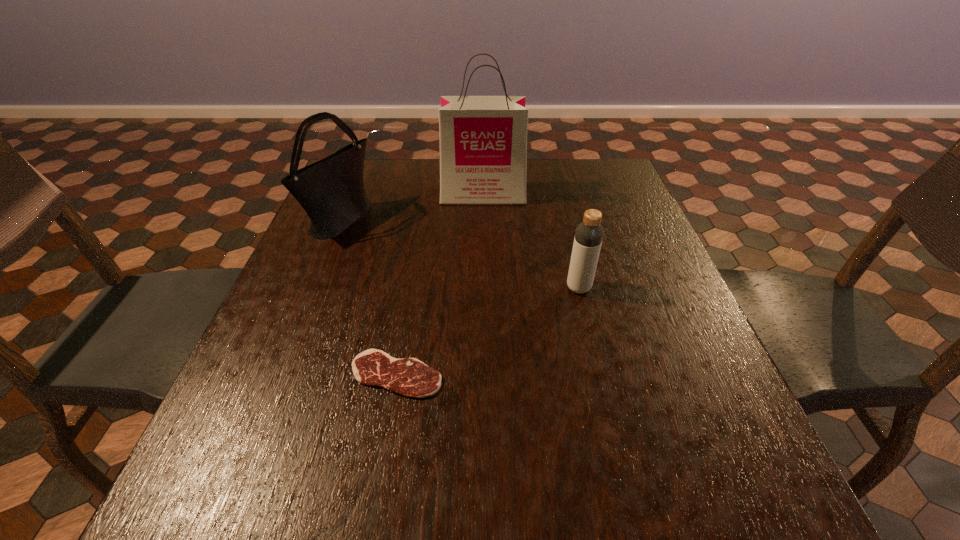
This screenshot has width=960, height=540. I want to click on free point located on the back of the nearest object, so click(x=419, y=245).

You are a GUI agent. You are given a task and a screenshot of the screen. Output one action in this format:
    pyautogui.click(x=<x>, y=<y>)
    Task: Click on the shopping bag that is at the far edge
    
    Given the screenshot: What is the action you would take?
    pos(483,139)

Where is `shoulder bag at the far edge`? shoulder bag at the far edge is located at coordinates (331, 191).

You are a GUI agent. You are given a task and a screenshot of the screen. Output one action in this format:
    pyautogui.click(x=<x>, y=<y>)
    Task: Click on the object that is at the left edge
    This screenshot has height=540, width=960.
    Given the screenshot: What is the action you would take?
    pyautogui.click(x=331, y=191)

This screenshot has width=960, height=540. In order to click on object that is at the far left corner in this screenshot , I will do `click(331, 191)`.

Where is `free location at the far edge`? This screenshot has width=960, height=540. free location at the far edge is located at coordinates (574, 194).

In the image, there is a desktop. At what (x,y) coordinates should I click in order to perform the action: click on free space at the near edge. Please return your answer as a coordinate pair (x, y). The height and width of the screenshot is (540, 960). Looking at the image, I should click on (657, 496).

This screenshot has width=960, height=540. Find the location of `free location at the left edge`. free location at the left edge is located at coordinates (330, 292).

I want to click on vacant area at the right edge, so click(x=610, y=248).

I want to click on free space at the far left corner, so click(390, 159).